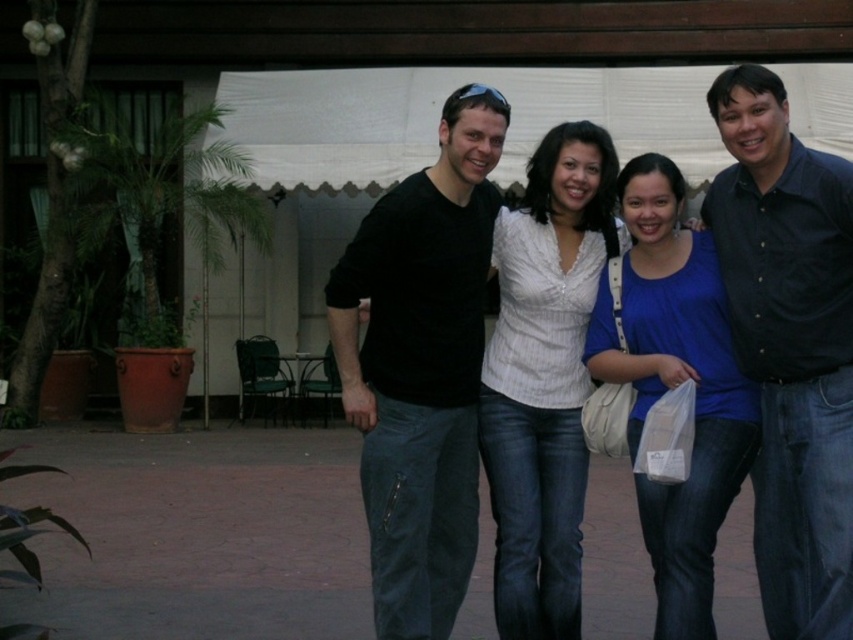
You are a photographer trying to adjust the lighting for a group photo. You notice the black shirt at center and the blue cotton shirt at center. Which shirt should you position closer to the light source to ensure both are well lit?

The black shirt at center is in front of the blue cotton shirt at center. Since the black shirt is in front, it should be moved closer to the light source so that both shirts receive adequate lighting.

You are a photographer trying to adjust the lighting for a group photo. You notice the matte black shirt at center and the blue cotton shirt at center. Which of these two shirts should you focus on to ensure proper exposure, considering their positions relative to each other?

The matte black shirt at center is above the blue cotton shirt at center, so focusing on the blue cotton shirt at center might be better for exposure since it is lower and possibly in a different lighting area.